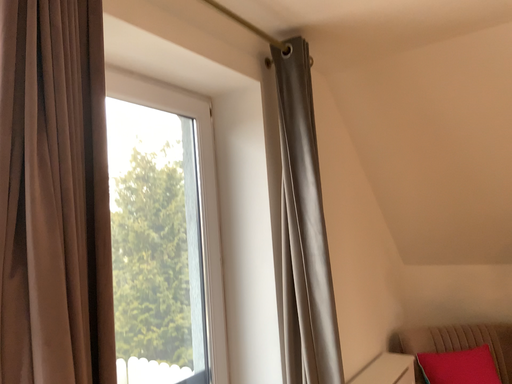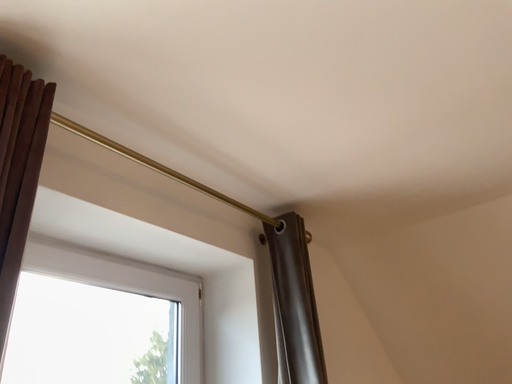
Question: How did the camera likely rotate when shooting the video?

Choices:
 (A) rotated downward
 (B) rotated upward

Answer: (B)